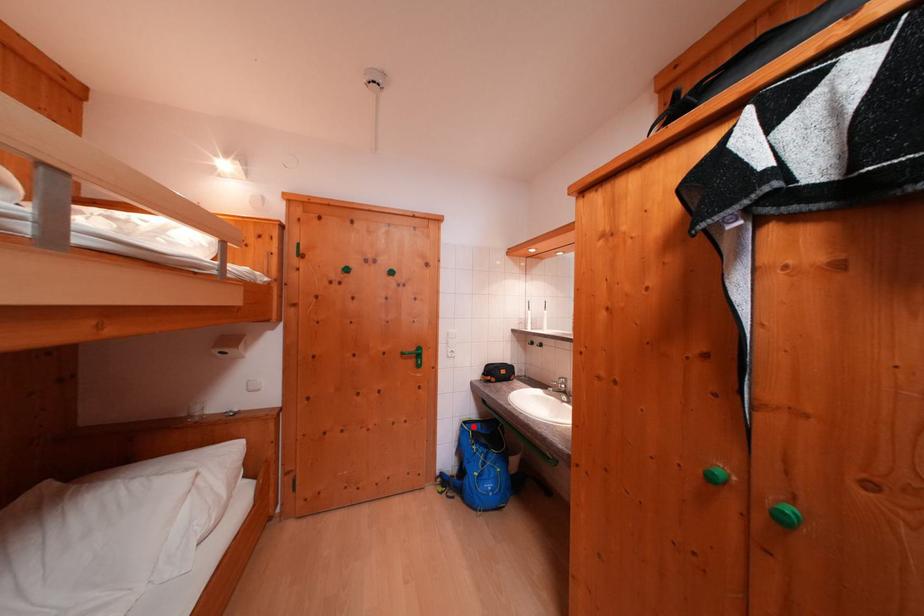
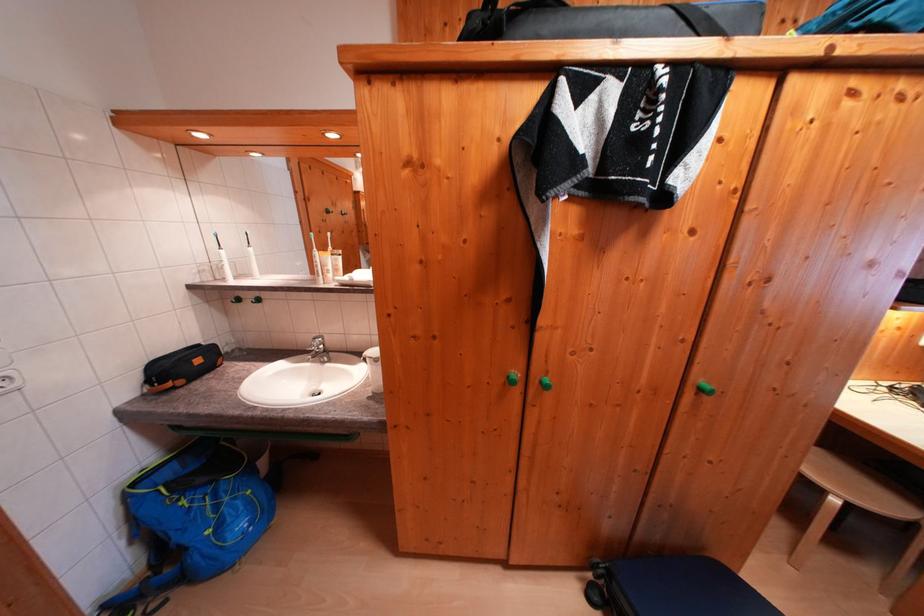
Question: I am providing you with two images of the same scene from different viewpoints. Image1 has a red point marked. In image2, the corresponding 3D location appears at what relative position? Reply with the corresponding letter.

Choices:
 (A) Closer
 (B) Farther

Answer: (A)